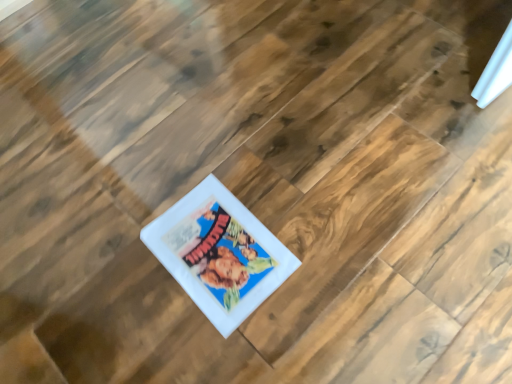
What do you see at coordinates (219, 253) in the screenshot? I see `white plastic picture frame at center` at bounding box center [219, 253].

Find the location of a particular element. white plastic picture frame at center is located at coordinates (219, 253).

In order to face white plastic picture frame at center, should I rotate leftwards or rightwards?

You should look left and rotate roughly 5.644 degrees.

Where is `white plastic picture frame at center`? white plastic picture frame at center is located at coordinates (219, 253).